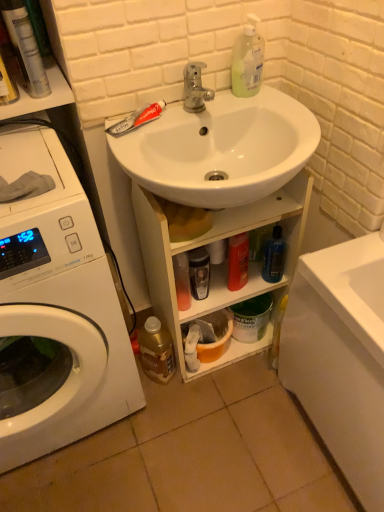
Locate an element on the screen. space that is in front of translucent plastic bottle at upper right is located at coordinates (274, 112).